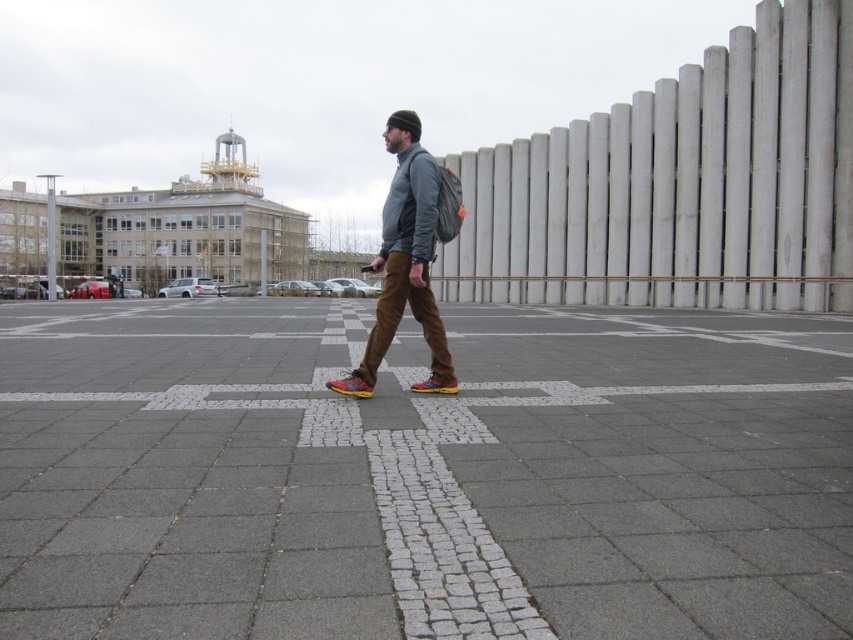
Between gray cobblestone pavement at center and multicolored synthetic shoe at center, which one has less height?

Standing shorter between the two is multicolored synthetic shoe at center.

Which is in front, point (463, 561) or point (416, 381)?

Positioned in front is point (463, 561).

The width and height of the screenshot is (853, 640). In order to click on gray cobblestone pavement at center in this screenshot , I will do [x=422, y=474].

Looking at this image, is multicolored leather shoe at center shorter than multicolored synthetic shoe at center?

Incorrect, multicolored leather shoe at center's height does not fall short of multicolored synthetic shoe at center's.

Does point (343, 385) lie in front of point (425, 392)?

Yes, it is.

Where is `multicolored leather shoe at center`? The height and width of the screenshot is (640, 853). multicolored leather shoe at center is located at coordinates (351, 385).

In the scene shown: Measure the distance between point (161, 618) and camera.

Point (161, 618) and camera are 1.78 meters apart from each other.

At what (x,y) coordinates should I click in order to perform the action: click on gray cobblestone pavement at center. Please return your answer as a coordinate pair (x, y). Looking at the image, I should click on tap(422, 474).

This screenshot has width=853, height=640. I want to click on gray cobblestone pavement at center, so click(x=422, y=474).